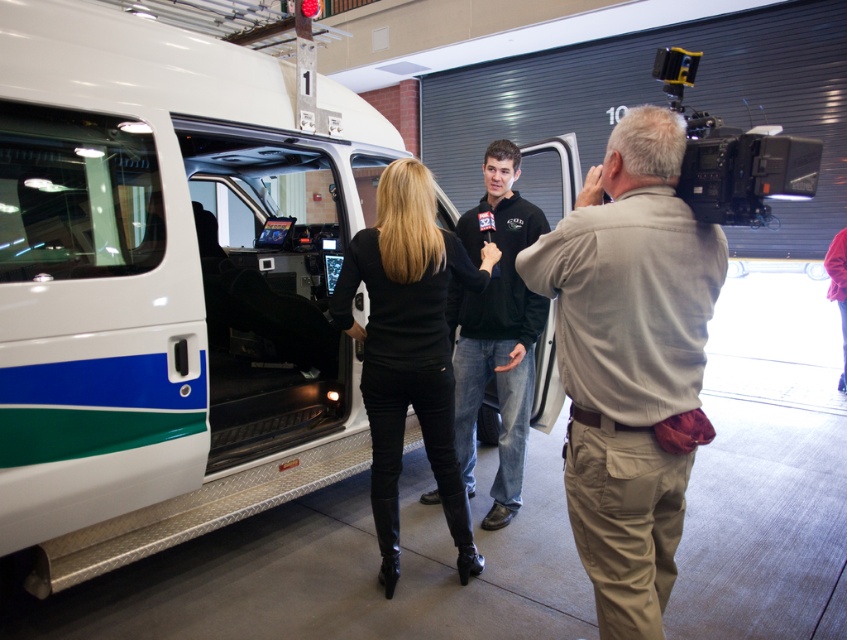
You are a photographer positioned at the origin point of the image. You want to take a photo of the black leather pants at center. What are the coordinates where you should aim your camera?

The coordinates to aim your camera are at point [408,349], as that is where the black leather pants at center are located.

You are a photographer trying to capture a clear shot of both the khaki cotton shirt at center and the black fleece at center during an interview. Since you want both subjects to be visible, which clothing item should you focus on to ensure it doesn not get cropped out?

The khaki cotton shirt at center occupies less space than the black fleece at center, so you should focus on the black fleece at center to ensure it doesn not get cropped out since it takes up more space.

You are standing at the point marked as point (674, 163) in the garage. You want to take a photo of the camera. Can you reach the camera from your current position without moving? The camera is 1.61 meters away.

The distance between point (674, 163) and the camera is 1.61 meters. If your arm length is sufficient to cover this distance, you might be able to reach it. However, typically, an average person cannot stretch their arm 1.61 meters, so it would likely require moving closer.